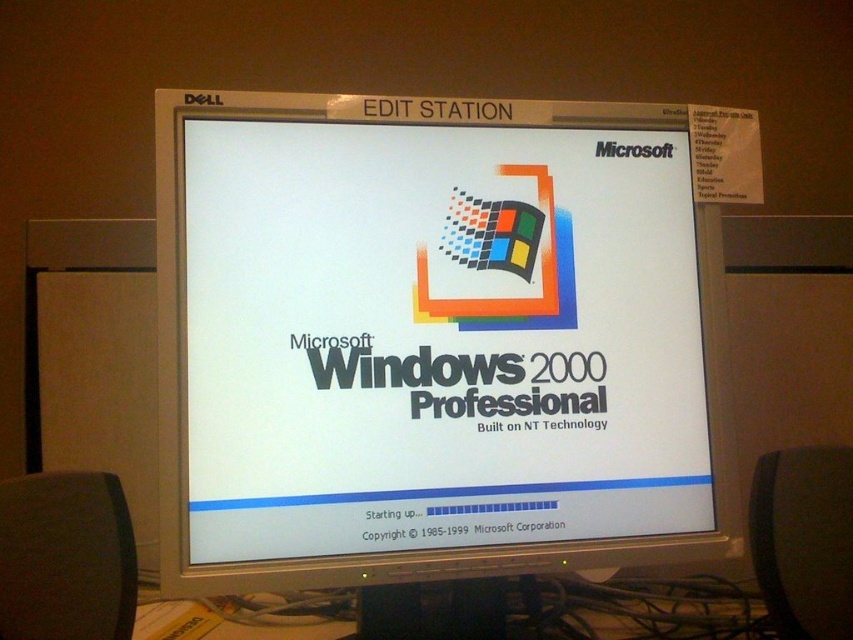
Question: Which of the following is the farthest from the observer?

Choices:
 (A) (332, 467)
 (B) (534, 240)

Answer: (B)

Question: Is the position of white glossy monitor at center more distant than that of multicolored pixelated square at center?

Choices:
 (A) yes
 (B) no

Answer: (B)

Question: Among these points, which one is nearest to the camera?

Choices:
 (A) (521, 168)
 (B) (254, 371)

Answer: (B)

Question: Does white glossy monitor at center appear on the right side of multicolored pixelated square at center?

Choices:
 (A) no
 (B) yes

Answer: (A)

Question: Which point appears closest to the camera in this image?

Choices:
 (A) tap(537, 220)
 (B) tap(556, 339)

Answer: (B)

Question: Can you confirm if white glossy monitor at center is positioned to the right of multicolored pixelated square at center?

Choices:
 (A) no
 (B) yes

Answer: (A)